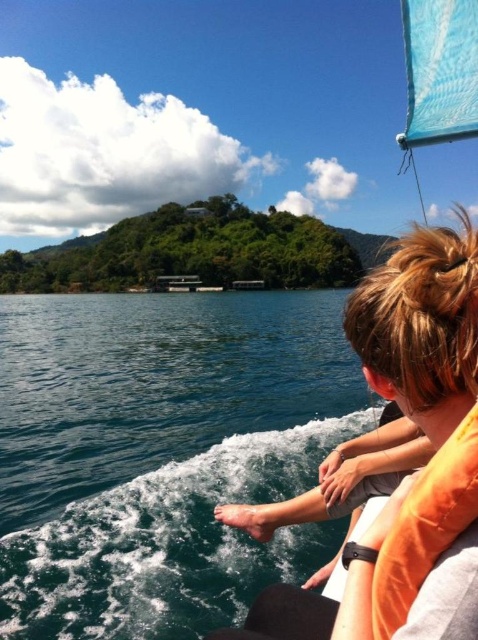
Question: Can you confirm if deep blue water at lower left is smaller than orange fabric life jacket at lower right?

Choices:
 (A) yes
 (B) no

Answer: (B)

Question: Is deep blue water at lower left smaller than orange fabric life jacket at lower right?

Choices:
 (A) yes
 (B) no

Answer: (B)

Question: Which point appears farthest from the camera in this image?

Choices:
 (A) (435, 531)
 (B) (219, 339)

Answer: (B)

Question: Which of the following is the closest to the observer?

Choices:
 (A) deep blue water at lower left
 (B) orange fabric life jacket at lower right

Answer: (B)

Question: Does deep blue water at lower left appear over orange fabric life jacket at lower right?

Choices:
 (A) no
 (B) yes

Answer: (A)